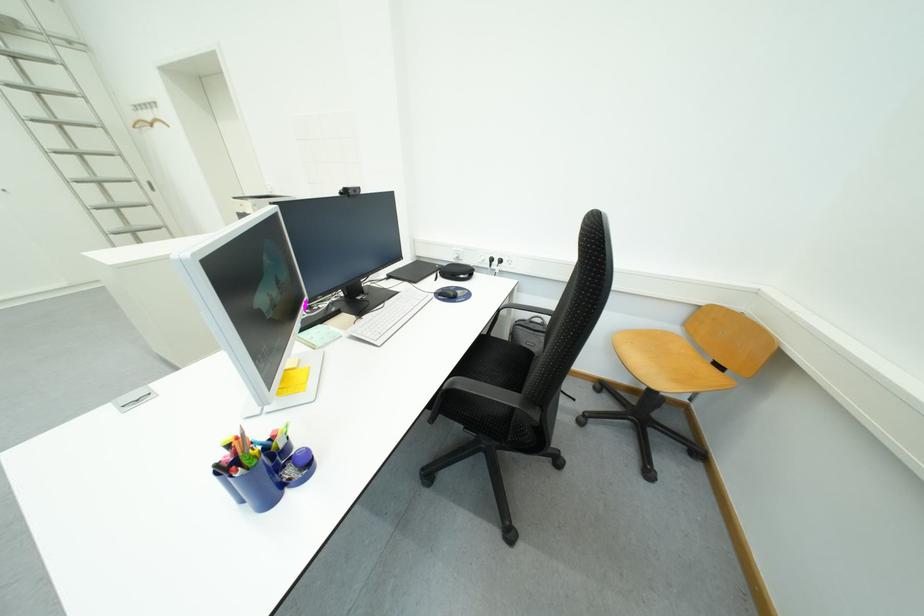
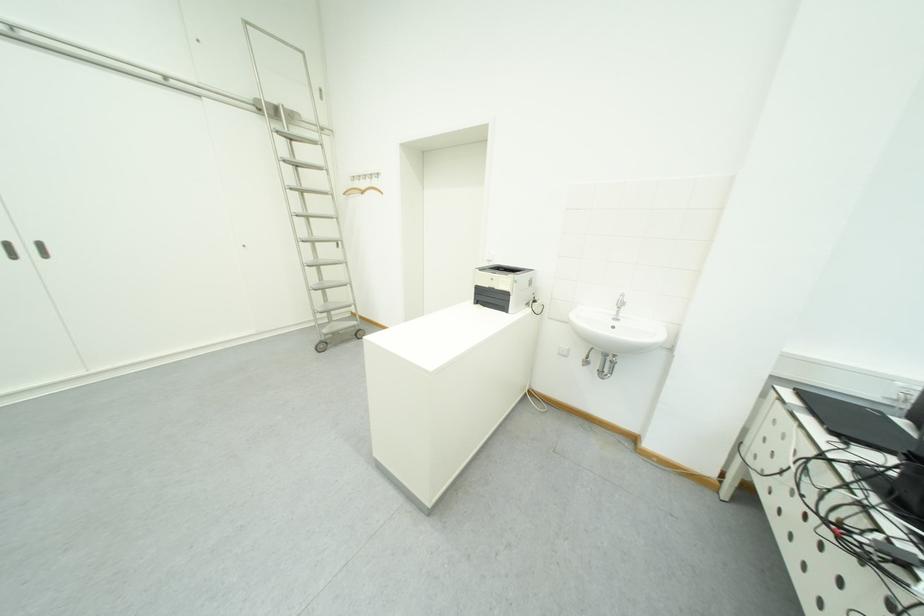
Question: Which direction would the cameraman need to move to produce the second image? Reply with the corresponding letter.

Choices:
 (A) Left
 (B) Right
 (C) Forward
 (D) Backward

Answer: (A)